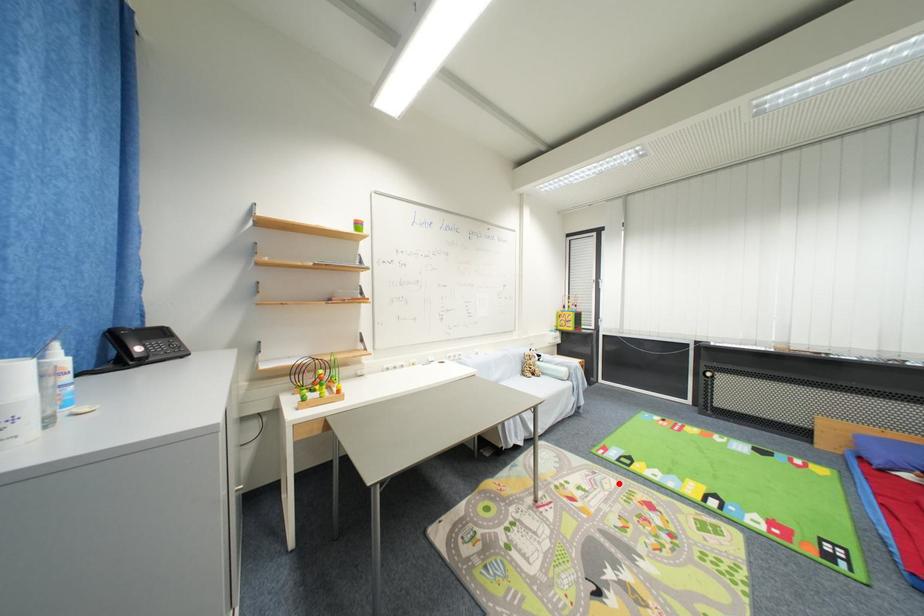
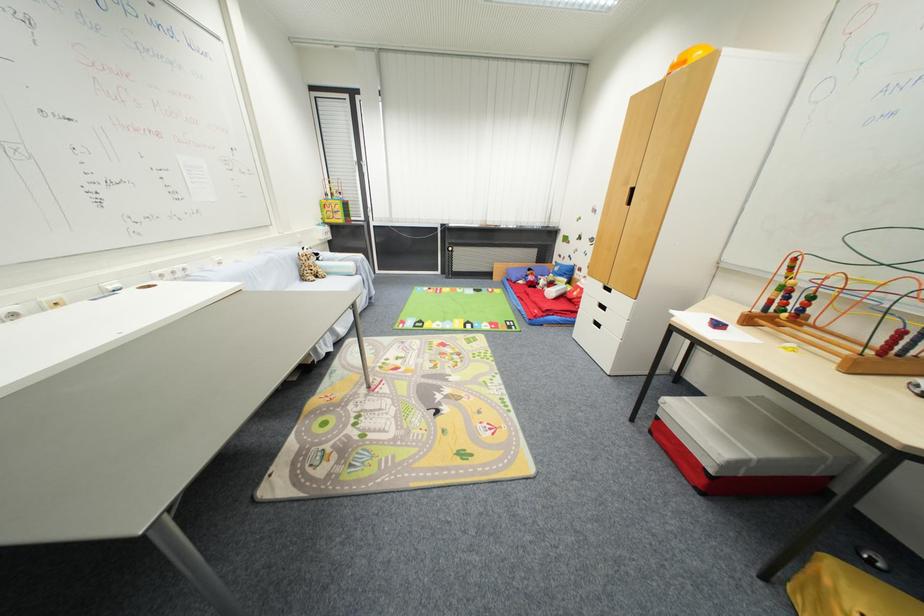
Find the pixel in the second image that matches the highlighted location in the first image.

(423, 342)